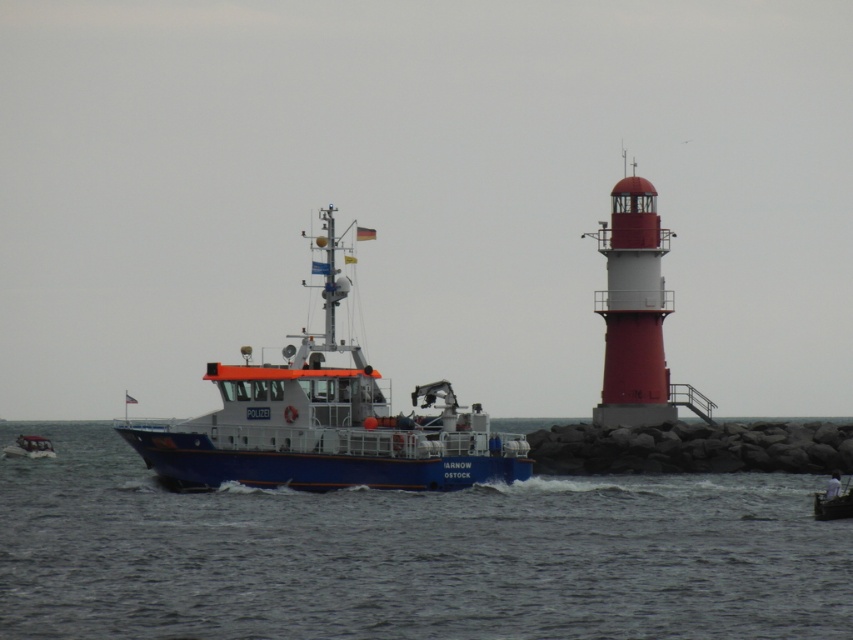
Question: From the image, what is the correct spatial relationship of blue metallic water at center in relation to metallic blue boat at center?

Choices:
 (A) above
 (B) below

Answer: (A)

Question: Which of the following is the farthest from the observer?

Choices:
 (A) (115, 467)
 (B) (27, 436)

Answer: (B)

Question: Does blue metallic water at center appear on the right side of blue matte boat at left?

Choices:
 (A) no
 (B) yes

Answer: (B)

Question: Which point appears farthest from the camera in this image?

Choices:
 (A) (50, 444)
 (B) (830, 481)

Answer: (A)

Question: Can you confirm if blue metallic water at center is positioned to the right of metallic blue boat at center?

Choices:
 (A) yes
 (B) no

Answer: (B)

Question: Which point is closer to the camera?

Choices:
 (A) (815, 492)
 (B) (795, 545)
 (C) (115, 426)

Answer: (B)